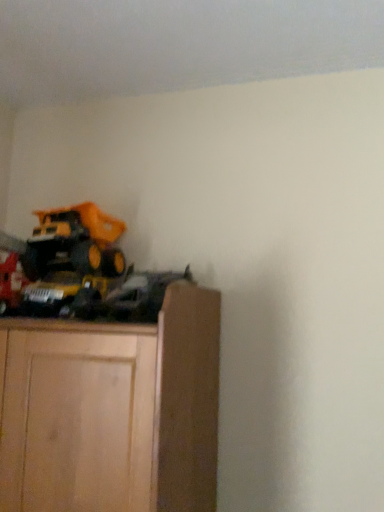
Question: Considering their positions, is yellow plastic toy truck at upper left located in front of or behind matte black train at left?

Choices:
 (A) behind
 (B) front

Answer: (A)

Question: Is yellow plastic toy truck at upper left inside the boundaries of matte black train at left, or outside?

Choices:
 (A) inside
 (B) outside

Answer: (B)

Question: From a real-world perspective, is yellow plastic toy truck at upper left physically located above or below matte black train at left?

Choices:
 (A) below
 (B) above

Answer: (B)

Question: Considering their positions, is matte black train at left located in front of or behind yellow plastic toy truck at upper left?

Choices:
 (A) behind
 (B) front

Answer: (B)

Question: Looking at their shapes, would you say matte black train at left is wider or thinner than yellow plastic toy truck at upper left?

Choices:
 (A) wide
 (B) thin

Answer: (B)

Question: Does point (3, 267) appear closer or farther from the camera than point (81, 267)?

Choices:
 (A) closer
 (B) farther

Answer: (A)

Question: From a real-world perspective, relative to yellow plastic toy truck at upper left, is matte black train at left vertically above or below?

Choices:
 (A) above
 (B) below

Answer: (B)